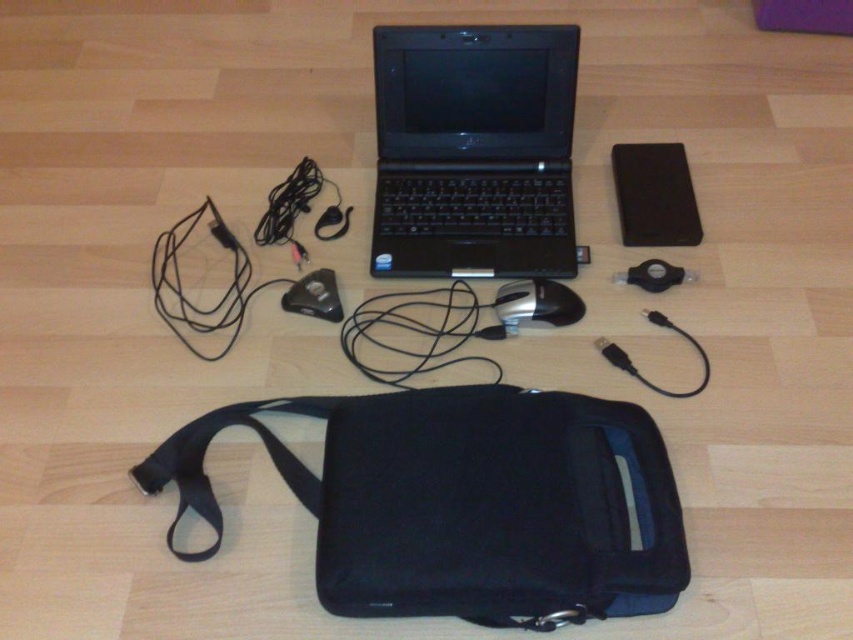
Question: Can you confirm if black plastic laptop at center is positioned to the left of black fabric strap at lower center?

Choices:
 (A) no
 (B) yes

Answer: (A)

Question: Can you confirm if black fabric pouch at lower center is wider than black matte mouse at center?

Choices:
 (A) no
 (B) yes

Answer: (B)

Question: Which point is farther from the camera taking this photo?

Choices:
 (A) (537, 317)
 (B) (265, 410)
 (C) (669, 156)

Answer: (C)

Question: Which point is closer to the camera?

Choices:
 (A) (503, 76)
 (B) (213, 513)

Answer: (B)

Question: Which of the following is the closest to the observer?

Choices:
 (A) (184, 444)
 (B) (526, 314)

Answer: (A)

Question: Does black fabric pouch at lower center appear under black fabric strap at lower center?

Choices:
 (A) no
 (B) yes

Answer: (B)